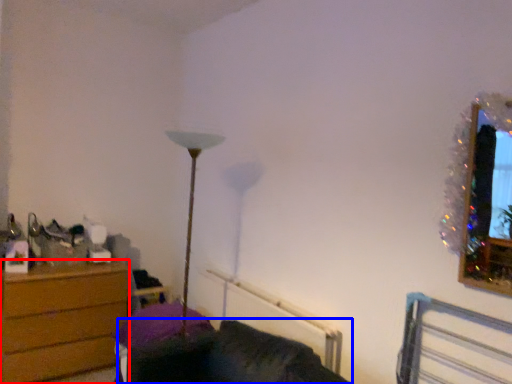
Question: Among these objects, which one is farthest to the camera, chest of drawers (highlighted by a red box) or couch (highlighted by a blue box)?

Choices:
 (A) chest of drawers
 (B) couch

Answer: (A)